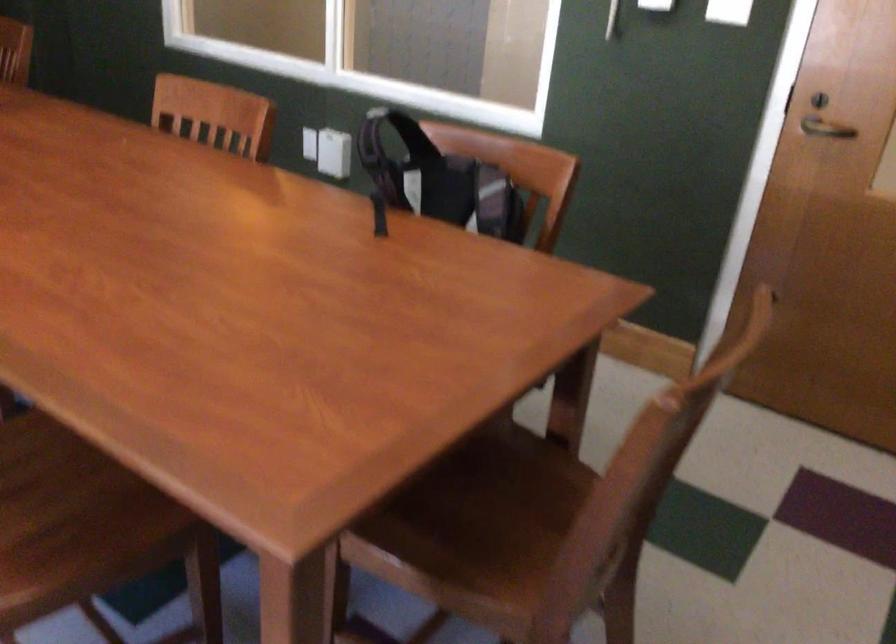
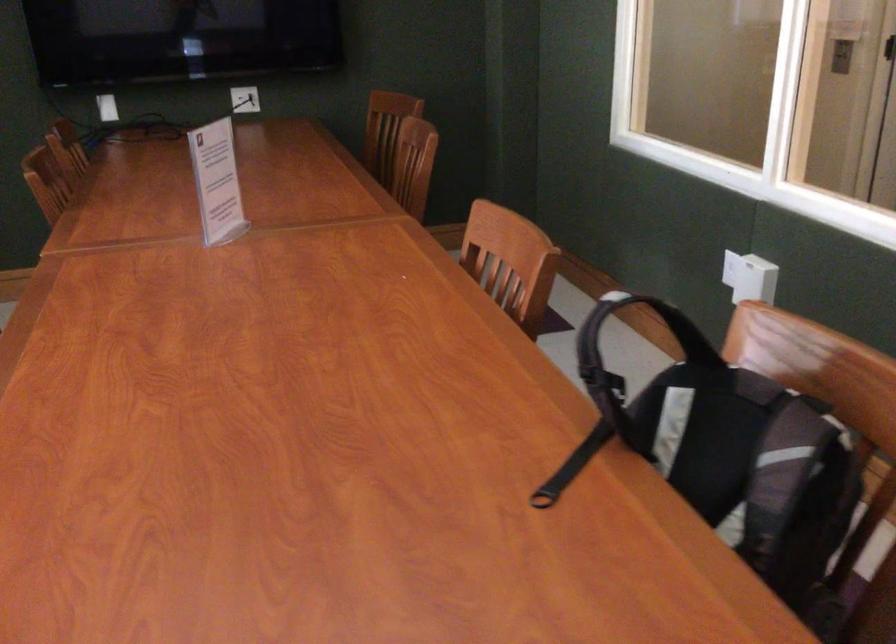
Where in the second image is the point corresponding to point (496, 190) from the first image?

(796, 456)